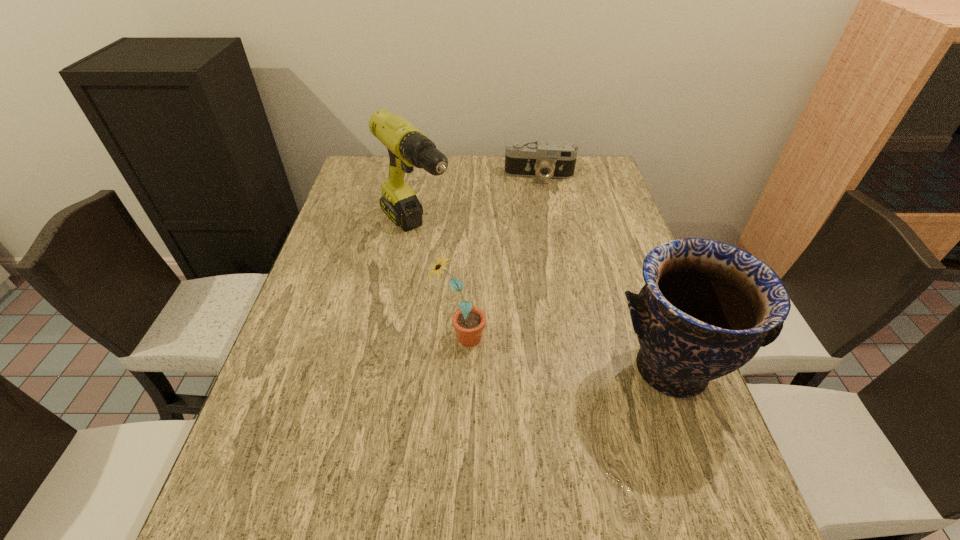
Where is `sunflower`? The image size is (960, 540). sunflower is located at coordinates (468, 321).

You are a GUI agent. You are given a task and a screenshot of the screen. Output one action in this format:
    pyautogui.click(x=<x>, y=<y>)
    Task: Click on the pottery
    
    Given the screenshot: What is the action you would take?
    pyautogui.click(x=707, y=307)

The width and height of the screenshot is (960, 540). In order to click on the second farthest object in this screenshot , I will do `click(407, 146)`.

Find the location of a particular element. The width and height of the screenshot is (960, 540). drill is located at coordinates (407, 146).

Locate an element on the screen. the farthest object is located at coordinates (553, 159).

Where is `camera`? The width and height of the screenshot is (960, 540). camera is located at coordinates (553, 159).

Identify the location of vacant space located on the flower of the sunflower. This screenshot has width=960, height=540. (530, 338).

Locate an element on the screen. The image size is (960, 540). free location located on the front handle of the pottery is located at coordinates (704, 462).

At what (x,y) coordinates should I click in order to perform the action: click on vacant space located 0.370m on the handle side of the tallest object. Please return your answer as a coordinate pair (x, y). Image resolution: width=960 pixels, height=540 pixels. Looking at the image, I should click on (523, 345).

Image resolution: width=960 pixels, height=540 pixels. I want to click on vacant space located 0.110m on the handle side of the tallest object, so click(x=459, y=280).